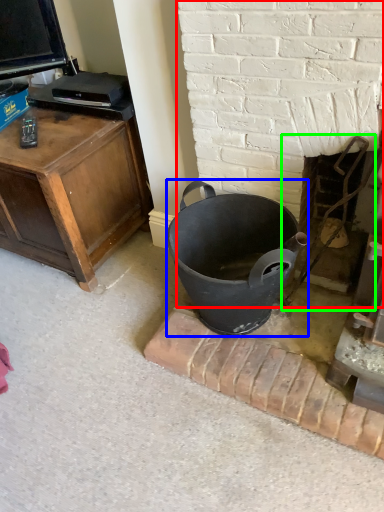
Question: Estimate the real-world distances between objects in this image. Which object is closer to fireplace (highlighted by a red box), trash bin/can (highlighted by a blue box) or fireplace (highlighted by a green box)?

Choices:
 (A) trash bin/can
 (B) fireplace

Answer: (B)